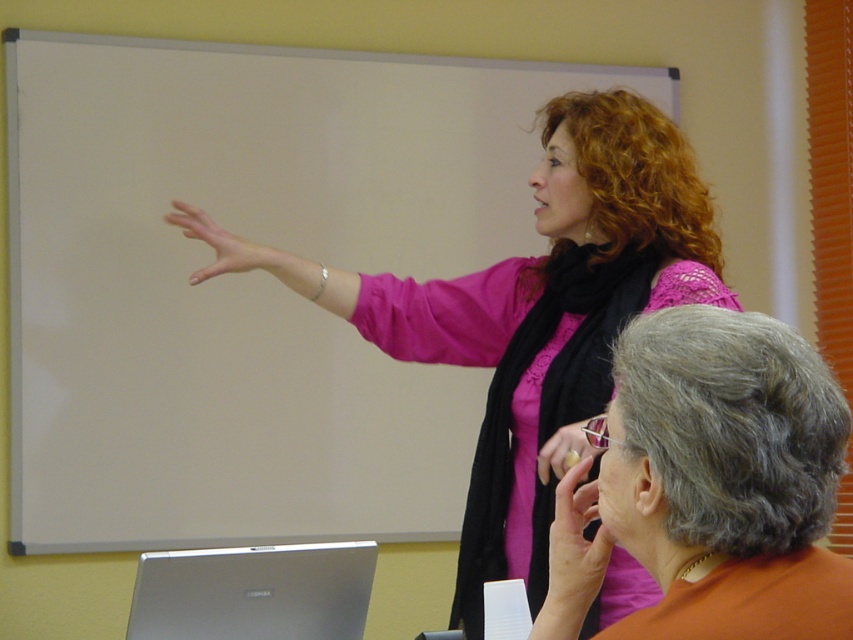
You are an assistant in the classroom. You need to place a 12cm tall book on a surface that can accommodate its height. Which object from the silver metallic laptop at lower left and the matte pink hand at upper center should you choose?

The silver metallic laptop at lower left is taller than the matte pink hand at upper center. Since the book is 12cm tall, the silver metallic laptop at lower left can accommodate it, while the matte pink hand at upper center cannot.

In the classroom scene, you see a smooth skin hand at upper right and a matte pink hand at upper center. Which hand is positioned higher in the image?

The smooth skin hand at upper right is positioned higher than the matte pink hand at upper center.

You are standing in the classroom and need to locate the silver metallic laptop at lower left. According to the coordinates provided, where exactly should you look to find it?

The silver metallic laptop at lower left is located at point (253, 593).